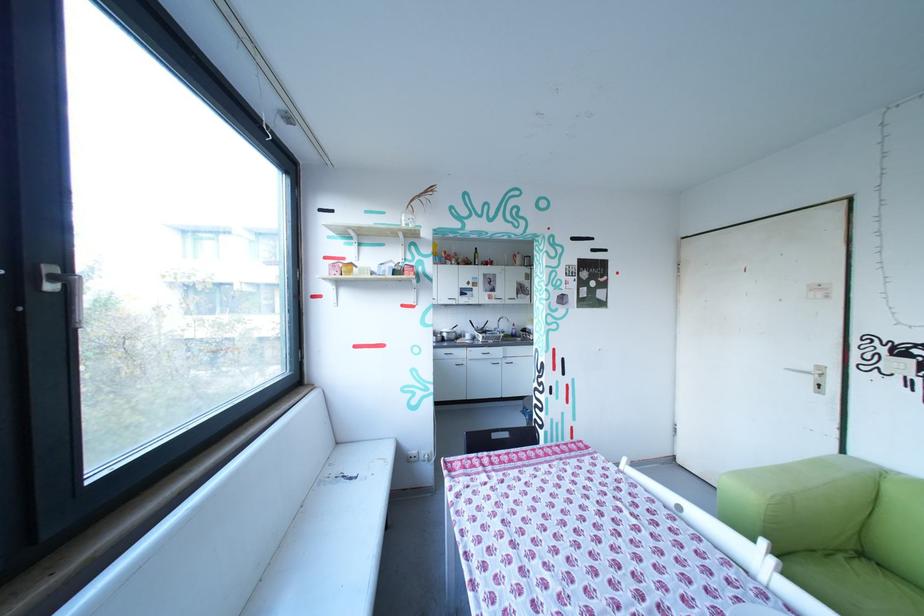
Locate an element on the screen. sink faucet handle is located at coordinates (502, 323).